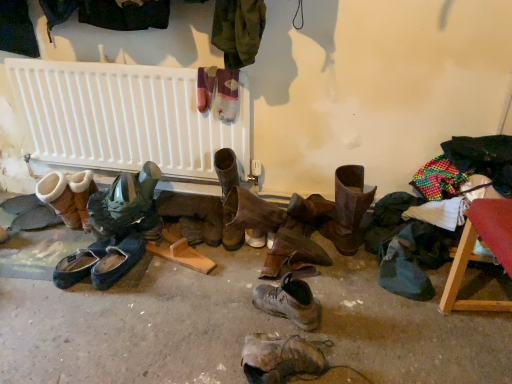
The height and width of the screenshot is (384, 512). I want to click on brown leather boot at center, which appears as the fourth footwear when viewed from the right, so click(226, 170).

Describe the element at coordinates (80, 264) in the screenshot. I see `black suede slippers at lower left, positioned as the 2th footwear in left-to-right order` at that location.

You are a GUI agent. You are given a task and a screenshot of the screen. Output one action in this format:
    pyautogui.click(x=<x>, y=<y>)
    Task: Click on the leather boot at center, which is the 2th footwear in right-to-left order
    This screenshot has width=512, height=384.
    Given the screenshot: What is the action you would take?
    pyautogui.click(x=289, y=302)

This screenshot has width=512, height=384. Describe the element at coordinates (289, 302) in the screenshot. I see `leather boot at center, which is the 2th footwear in right-to-left order` at that location.

At what (x,y) coordinates should I click in order to perform the action: click on dark blue leather shoes at center, which appears as the 4th footwear when viewed from the left. Please return your answer as a coordinate pair (x, y). This screenshot has width=512, height=384. Looking at the image, I should click on (118, 261).

Locate an element on the screen. The width and height of the screenshot is (512, 384). green rubber boots at left, acting as the seventh footwear starting from the right is located at coordinates (125, 204).

What are the coordinates of `suede/leather boot at left, which appears as the first footwear when viewed from the left` in the screenshot? It's located at (82, 194).

In terms of height, does brown leather boot at center, which appears as the fourth footwear when viewed from the right, look taller or shorter compared to brown leather boot at center, which is the first footwear in right-to-left order?

brown leather boot at center, which appears as the fourth footwear when viewed from the right, is shorter than brown leather boot at center, which is the first footwear in right-to-left order.

Are brown leather boot at center, the sixth footwear positioned from the left, and brown leather boot at center, which appears as the ninth footwear when viewed from the left, making contact?

No.

From the picture: Between brown leather boot at center, the sixth footwear positioned from the left, and brown leather boot at center, which is the first footwear in right-to-left order, which one has smaller width?

brown leather boot at center, the sixth footwear positioned from the left.

The width and height of the screenshot is (512, 384). I want to click on footwear that is the 4th object to the left of the brown leather boot at center, which appears as the ninth footwear when viewed from the left, starting at the anchor, so click(194, 211).

Which is in front, brown leather boot at center, which appears as the ninth footwear when viewed from the left, or leather boots at center, the 5th footwear when ordered from right to left?

brown leather boot at center, which appears as the ninth footwear when viewed from the left, is more forward.

Can you confirm if brown leather boot at center, which appears as the ninth footwear when viewed from the left, is shorter than leather boots at center, the 5th footwear when ordered from right to left?

Incorrect, the height of brown leather boot at center, which appears as the ninth footwear when viewed from the left, does not fall short of that of leather boots at center, the 5th footwear when ordered from right to left.

In the scene shown: Considering the sizes of dark blue leather shoes at center, which is counted as the sixth footwear, starting from the right, and white plastic radiator at upper center in the image, is dark blue leather shoes at center, which is counted as the sixth footwear, starting from the right, taller or shorter than white plastic radiator at upper center?

Clearly, dark blue leather shoes at center, which is counted as the sixth footwear, starting from the right, is shorter compared to white plastic radiator at upper center.

Locate an element on the screen. footwear that is the 8th one below the white plastic radiator at upper center (from a real-world perspective) is located at coordinates pos(118,261).

Consider the image. Is dark blue leather shoes at center, which appears as the 4th footwear when viewed from the left, closer to the viewer compared to white plastic radiator at upper center?

Yes, it is in front of white plastic radiator at upper center.

Considering the relative sizes of dark blue leather shoes at center, which is counted as the sixth footwear, starting from the right, and white plastic radiator at upper center in the image provided, is dark blue leather shoes at center, which is counted as the sixth footwear, starting from the right, thinner than white plastic radiator at upper center?

In fact, dark blue leather shoes at center, which is counted as the sixth footwear, starting from the right, might be wider than white plastic radiator at upper center.

Does point (76, 174) come farther from viewer compared to point (106, 208)?

Yes, point (76, 174) is farther from viewer.

In the scene shown: How far apart are suede/leather boot at left, marked as the ninth footwear in a right-to-left arrangement, and green rubber boots at left, acting as the seventh footwear starting from the right?

suede/leather boot at left, marked as the ninth footwear in a right-to-left arrangement, is 18.90 centimeters away from green rubber boots at left, acting as the seventh footwear starting from the right.

Could you tell me if suede/leather boot at left, which appears as the first footwear when viewed from the left, is turned towards green rubber boots at left, acting as the seventh footwear starting from the right?

No, suede/leather boot at left, which appears as the first footwear when viewed from the left, is not facing towards green rubber boots at left, acting as the seventh footwear starting from the right.

Could green rubber boots at left, which is the third footwear from left to right, be considered to be inside suede/leather boot at left, marked as the ninth footwear in a right-to-left arrangement?

No, green rubber boots at left, which is the third footwear from left to right, is not a part of suede/leather boot at left, marked as the ninth footwear in a right-to-left arrangement.

From the green rubber boots at left, acting as the seventh footwear starting from the right, count 4th footwears forward and point to it. Please provide its 2D coordinates.

[(289, 302)]

From a real-world perspective, is green rubber boots at left, which is the third footwear from left to right, positioned under leather boot at center, the 8th footwear in the left-to-right sequence, based on gravity?

No, from a real-world perspective, green rubber boots at left, which is the third footwear from left to right, is not beneath leather boot at center, the 8th footwear in the left-to-right sequence.

From the image's perspective, relative to leather boot at center, which is the 2th footwear in right-to-left order, is green rubber boots at left, acting as the seventh footwear starting from the right, above or below?

From the image's perspective, green rubber boots at left, acting as the seventh footwear starting from the right, appears above leather boot at center, which is the 2th footwear in right-to-left order.

Is the depth of green rubber boots at left, acting as the seventh footwear starting from the right, less than that of leather boot at center, the 8th footwear in the left-to-right sequence?

No, green rubber boots at left, acting as the seventh footwear starting from the right, is further to the viewer.

Is brown leather boot at center, the sixth footwear positioned from the left, positioned with its back to leather boot at center, the 8th footwear in the left-to-right sequence?

No, brown leather boot at center, the sixth footwear positioned from the left, is not facing away from leather boot at center, the 8th footwear in the left-to-right sequence.

Between brown leather boot at center, which appears as the fourth footwear when viewed from the right, and leather boot at center, which is the 2th footwear in right-to-left order, which one has larger size?

Bigger between the two is brown leather boot at center, which appears as the fourth footwear when viewed from the right.

Locate an element on the screen. the 2nd footwear to the right when counting from the brown leather boot at center, the sixth footwear positioned from the left is located at coordinates pos(289,302).

From a real-world perspective, does brown leather boot at center, the sixth footwear positioned from the left, stand above leather boot at center, the 8th footwear in the left-to-right sequence?

Indeed, from a real-world perspective, brown leather boot at center, the sixth footwear positioned from the left, stands above leather boot at center, the 8th footwear in the left-to-right sequence.

From a real-world perspective, between leather boots at center, the 5th footwear when ordered from left to right, and green rubber boots at left, which is the third footwear from left to right, who is vertically lower?

In real-world perspective, leather boots at center, the 5th footwear when ordered from left to right, is lower.

Is leather boots at center, the 5th footwear when ordered from left to right, thinner than green rubber boots at left, acting as the seventh footwear starting from the right?

Correct, the width of leather boots at center, the 5th footwear when ordered from left to right, is less than that of green rubber boots at left, acting as the seventh footwear starting from the right.

Does leather boots at center, the 5th footwear when ordered from left to right, touch green rubber boots at left, which is the third footwear from left to right?

No, leather boots at center, the 5th footwear when ordered from left to right, is not beside green rubber boots at left, which is the third footwear from left to right.

Where is `the 3rd footwear to the left of the brown leather boot at center, which appears as the ninth footwear when viewed from the left, counting from the anchor's position`? This screenshot has width=512, height=384. the 3rd footwear to the left of the brown leather boot at center, which appears as the ninth footwear when viewed from the left, counting from the anchor's position is located at coordinates (226, 170).

Locate an element on the screen. the 5th footwear directly above the leather boots at center, the 5th footwear when ordered from left to right (from a real-world perspective) is located at coordinates coord(348,209).

Based on their spatial positions, is leather boot at center, the 8th footwear in the left-to-right sequence, or suede/leather boot at left, which appears as the first footwear when viewed from the left, further from white plastic radiator at upper center?

A: Among the two, leather boot at center, the 8th footwear in the left-to-right sequence, is located further to white plastic radiator at upper center.

From the image, which object appears to be nearer to green rubber boots at left, which is the third footwear from left to right, brown leather boot at center, which appears as the fourth footwear when viewed from the right, or brown leather boot at center, which is the first footwear in right-to-left order?

brown leather boot at center, which appears as the fourth footwear when viewed from the right, is closer to green rubber boots at left, which is the third footwear from left to right.

From the image, which object appears to be nearer to leather boot at center, which is the 2th footwear in right-to-left order, brown leather boot at center, which is the first footwear in right-to-left order, or black suede slippers at lower left, positioned as the 2th footwear in left-to-right order?

brown leather boot at center, which is the first footwear in right-to-left order.

Estimate the real-world distances between objects in this image. Which object is further from suede/leather boot at left, which appears as the first footwear when viewed from the left, leather boot at lower center, the seventh footwear in the left-to-right sequence, or black suede slippers at lower left, positioned as the 2th footwear in left-to-right order?

Based on the image, leather boot at lower center, the seventh footwear in the left-to-right sequence, appears to be further to suede/leather boot at left, which appears as the first footwear when viewed from the left.

Considering their positions, is black suede slippers at lower left, positioned as the 2th footwear in left-to-right order, positioned further to dark blue leather shoes at center, which appears as the 4th footwear when viewed from the left, than leather boot at lower center, the seventh footwear in the left-to-right sequence?

leather boot at lower center, the seventh footwear in the left-to-right sequence.

Which object lies nearer to the anchor point leather boot at lower center, the seventh footwear in the left-to-right sequence, green rubber boots at left, acting as the seventh footwear starting from the right, or brown leather boot at center, the sixth footwear positioned from the left?

brown leather boot at center, the sixth footwear positioned from the left, lies closer to leather boot at lower center, the seventh footwear in the left-to-right sequence, than the other object.

Estimate the real-world distances between objects in this image. Which object is closer to leather boots at center, the 5th footwear when ordered from left to right, leather boot at center, the 8th footwear in the left-to-right sequence, or leather boot at lower center, acting as the 3th footwear starting from the right?

The object closer to leather boots at center, the 5th footwear when ordered from left to right, is leather boot at center, the 8th footwear in the left-to-right sequence.

From the picture: Which object lies nearer to the anchor point leather boot at center, which is the 2th footwear in right-to-left order, dark blue leather shoes at center, which is counted as the sixth footwear, starting from the right, or suede/leather boot at left, which appears as the first footwear when viewed from the left?

Among the two, dark blue leather shoes at center, which is counted as the sixth footwear, starting from the right, is located nearer to leather boot at center, which is the 2th footwear in right-to-left order.

Find the location of a particular element. The width and height of the screenshot is (512, 384). radiator between black suede slippers at lower left, placed as the 8th footwear when sorted from right to left, and leather boot at center, which is the 2th footwear in right-to-left order is located at coordinates (123, 118).

At what (x,y) coordinates should I click in order to perform the action: click on footwear between dark blue leather shoes at center, which is counted as the sixth footwear, starting from the right, and brown leather boot at center, which appears as the fourth footwear when viewed from the right, from left to right. Please return your answer as a coordinate pair (x, y). The image size is (512, 384). Looking at the image, I should click on (194, 211).

This screenshot has height=384, width=512. I want to click on radiator between black suede slippers at lower left, positioned as the 2th footwear in left-to-right order, and brown leather boot at center, which appears as the fourth footwear when viewed from the right, from left to right, so click(123, 118).

In order to click on footwear situated between green rubber boots at left, acting as the seventh footwear starting from the right, and leather boots at center, the 5th footwear when ordered from left to right, from left to right in this screenshot , I will do `click(118, 261)`.